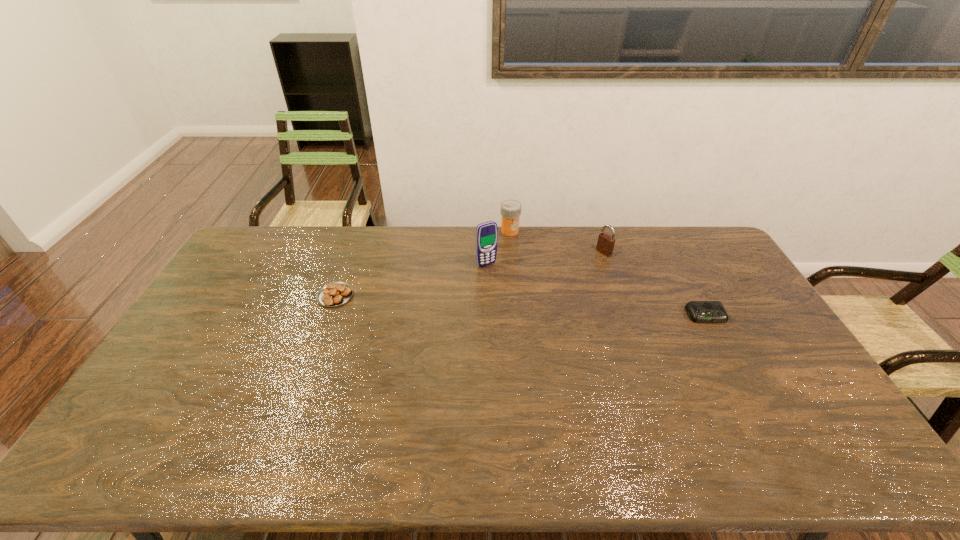
Image resolution: width=960 pixels, height=540 pixels. Find the location of `the leftmost object`. the leftmost object is located at coordinates (334, 294).

Where is `the rightmost object`? Image resolution: width=960 pixels, height=540 pixels. the rightmost object is located at coordinates (699, 311).

In order to click on the second farthest object in this screenshot , I will do `click(605, 245)`.

Locate an element on the screen. the fourth object from left to right is located at coordinates (605, 245).

This screenshot has height=540, width=960. I want to click on the farthest object, so (510, 209).

Where is `medicine`? This screenshot has height=540, width=960. medicine is located at coordinates (510, 209).

The width and height of the screenshot is (960, 540). I want to click on the tallest object, so click(x=486, y=233).

Where is `the fourth object from right to left`? the fourth object from right to left is located at coordinates (486, 233).

The width and height of the screenshot is (960, 540). In order to click on vacant region located 0.090m on the left of the leftmost object in this screenshot , I will do `click(290, 296)`.

You are a GUI agent. You are given a task and a screenshot of the screen. Output one action in this format:
    pyautogui.click(x=<x>, y=<y>)
    Task: Click on the vacant space located 0.130m on the display of the alarm clock
    
    Given the screenshot: What is the action you would take?
    pyautogui.click(x=729, y=356)